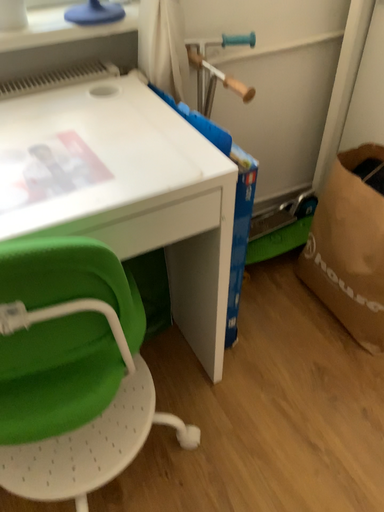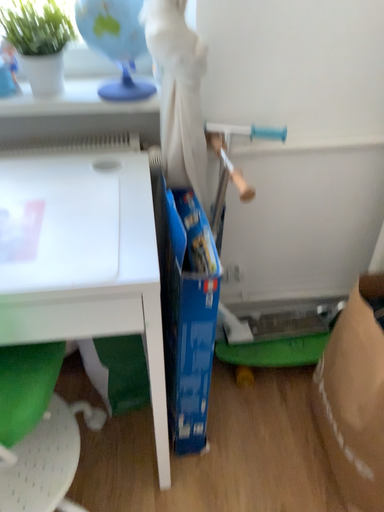
Question: Which way did the camera rotate in the video?

Choices:
 (A) rotated left
 (B) rotated right

Answer: (A)